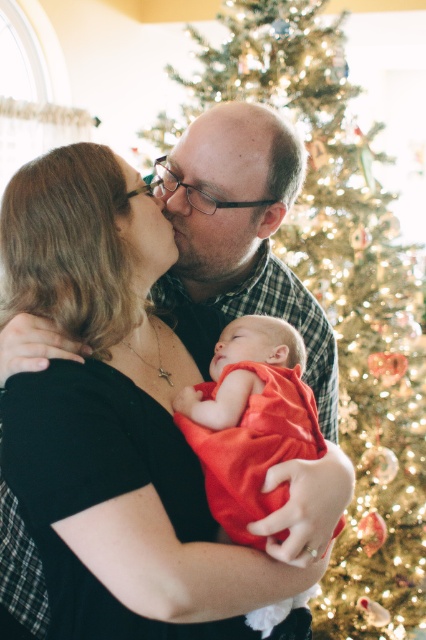
Who is shorter, silky red swaddle at center or matte plaid shirt at center?

With less height is matte plaid shirt at center.

Can you confirm if silky red swaddle at center is positioned above matte plaid shirt at center?

No.

The width and height of the screenshot is (426, 640). Find the location of `silky red swaddle at center`. silky red swaddle at center is located at coordinates (250, 419).

Find the location of `silky red swaddle at center`. silky red swaddle at center is located at coordinates (250, 419).

Is silky red swaddle at center smaller than smooth bald head at center?

Incorrect, silky red swaddle at center is not smaller in size than smooth bald head at center.

Does silky red swaddle at center have a lesser height compared to smooth bald head at center?

Incorrect, silky red swaddle at center's height does not fall short of smooth bald head at center's.

Does point (270, 408) come farther from viewer compared to point (250, 148)?

No.

At what (x,y) coordinates should I click in order to perform the action: click on silky red swaddle at center. Please return your answer as a coordinate pair (x, y). This screenshot has width=426, height=640. Looking at the image, I should click on (250, 419).

Who is higher up, shiny gold ornaments at upper center or matte black nose at center?

matte black nose at center is higher up.

Measure the distance between point [319,381] and camera.

Point [319,381] and camera are 1.28 meters apart.

This screenshot has height=640, width=426. I want to click on shiny gold ornaments at upper center, so click(x=339, y=294).